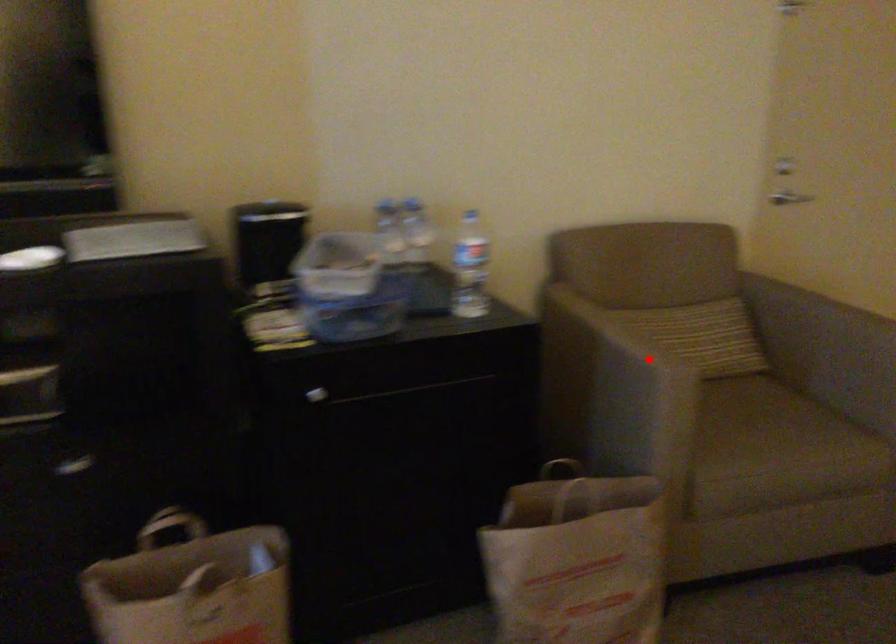
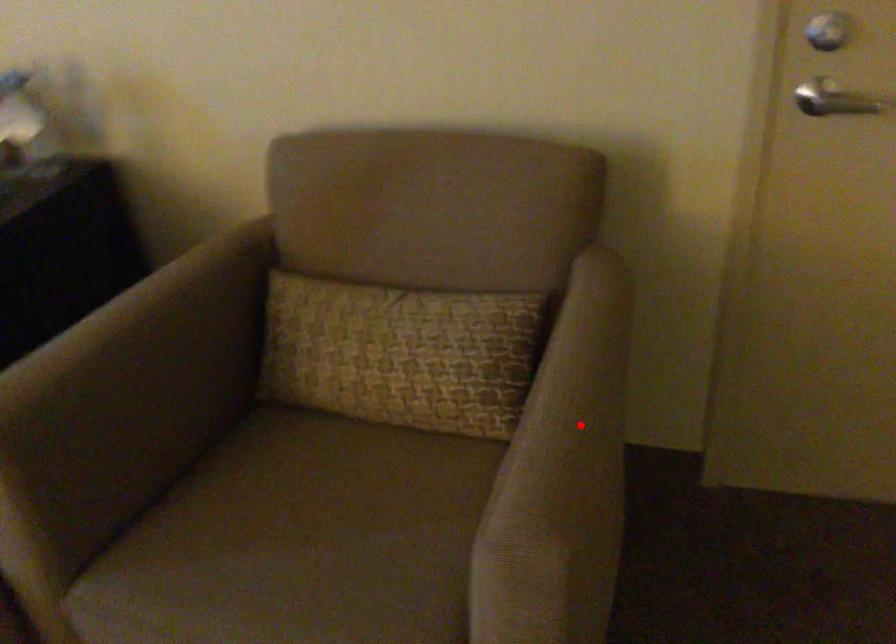
I am providing you with two images of the same scene from different viewpoints. A red point is marked on the first image and another point is marked on the second image. Does the point marked in image1 correspond to the same location as the one in image2?

No